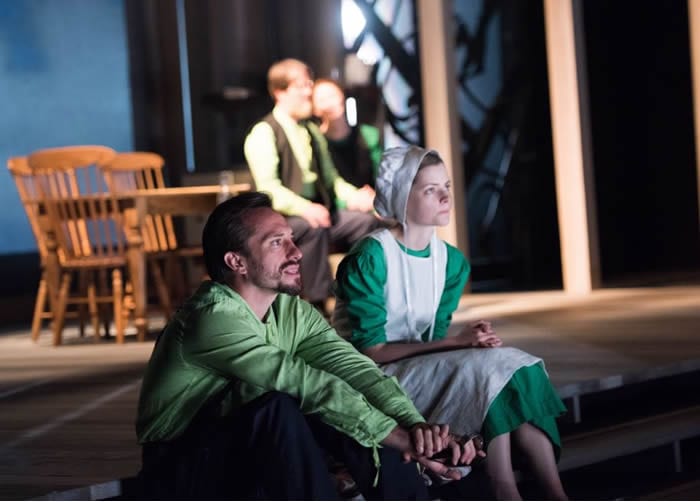
Locate an element on the screen. seat of chair is located at coordinates click(x=190, y=252), click(x=97, y=262).